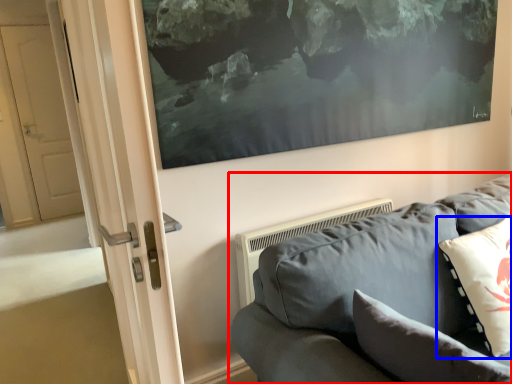
Question: Among these objects, which one is farthest to the camera, studio couch (highlighted by a red box) or pillow (highlighted by a blue box)?

Choices:
 (A) studio couch
 (B) pillow

Answer: (B)